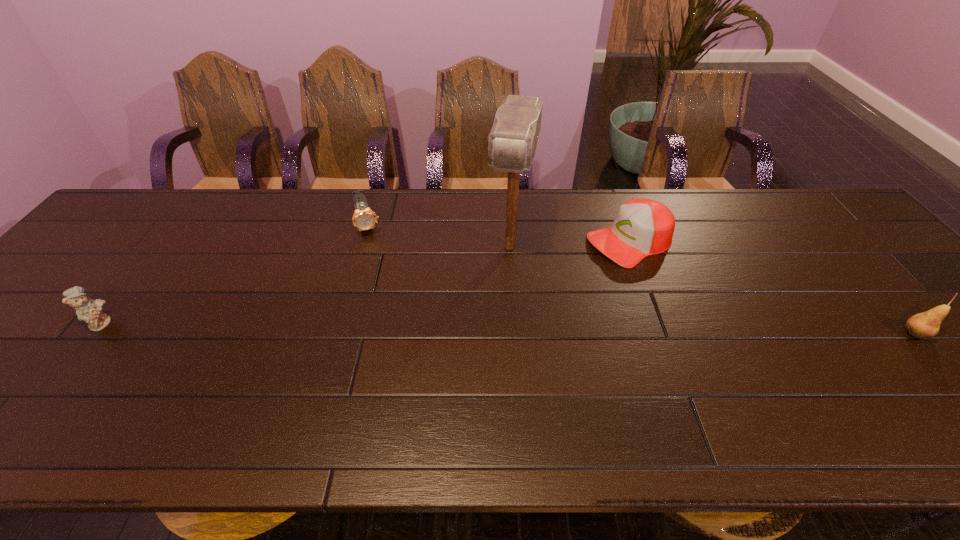
The width and height of the screenshot is (960, 540). Identify the location of vacant space on the desktop that is between the teddy bear and the rightmost object and is positioned above the head of the third object from right to left. (489, 328).

Where is `vacant space on the desktop that is between the leftmost object and the pear and is positioned on the face of the watch`? vacant space on the desktop that is between the leftmost object and the pear and is positioned on the face of the watch is located at coordinates (397, 327).

Identify the location of vacant space on the desktop that is between the teddy bear and the rightmost object and is positioned on the front-facing side of the fourth object from left to right. The image size is (960, 540). (453, 327).